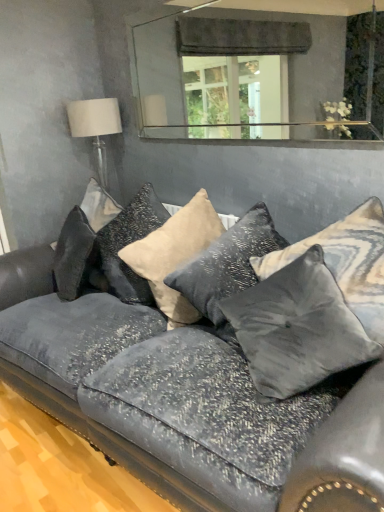
Question: Which direction should I rotate to look at satin beige pillow at center, the 4th pillow in the right-to-left sequence, — up or down?

Choices:
 (A) up
 (B) down

Answer: (B)

Question: Are clear glass mirror at upper center and velvet couch at center located far from each other?

Choices:
 (A) no
 (B) yes

Answer: (B)

Question: Is clear glass mirror at upper center smaller than velvet couch at center?

Choices:
 (A) yes
 (B) no

Answer: (A)

Question: Is clear glass mirror at upper center positioned before velvet couch at center?

Choices:
 (A) no
 (B) yes

Answer: (A)

Question: Is the position of clear glass mirror at upper center more distant than that of velvet couch at center?

Choices:
 (A) yes
 (B) no

Answer: (A)

Question: From a real-world perspective, is clear glass mirror at upper center located higher than velvet couch at center?

Choices:
 (A) no
 (B) yes

Answer: (B)

Question: Considering the relative sizes of clear glass mirror at upper center and velvet couch at center in the image provided, is clear glass mirror at upper center thinner than velvet couch at center?

Choices:
 (A) yes
 (B) no

Answer: (A)

Question: Can you confirm if velvet gray pillow at center, arranged as the 2th pillow when viewed from the right, is wider than velvet couch at center?

Choices:
 (A) no
 (B) yes

Answer: (A)

Question: Considering the relative positions of velvet gray pillow at center, arranged as the 2th pillow when viewed from the right, and velvet couch at center in the image provided, is velvet gray pillow at center, arranged as the 2th pillow when viewed from the right, to the left of velvet couch at center from the viewer's perspective?

Choices:
 (A) yes
 (B) no

Answer: (B)

Question: Is velvet couch at center a part of velvet gray pillow at center, acting as the fourth pillow starting from the left?

Choices:
 (A) no
 (B) yes

Answer: (A)

Question: Is velvet gray pillow at center, arranged as the 2th pillow when viewed from the right, closer to the viewer compared to velvet couch at center?

Choices:
 (A) yes
 (B) no

Answer: (B)

Question: Can you confirm if velvet gray pillow at center, acting as the fourth pillow starting from the left, is thinner than velvet couch at center?

Choices:
 (A) no
 (B) yes

Answer: (B)

Question: Can you confirm if velvet gray pillow at center, arranged as the 2th pillow when viewed from the right, is bigger than velvet couch at center?

Choices:
 (A) yes
 (B) no

Answer: (B)

Question: Does velvet gray pillow at center, arranged as the 2th pillow when viewed from the right, turn towards white fabric lampshade at upper left?

Choices:
 (A) no
 (B) yes

Answer: (A)